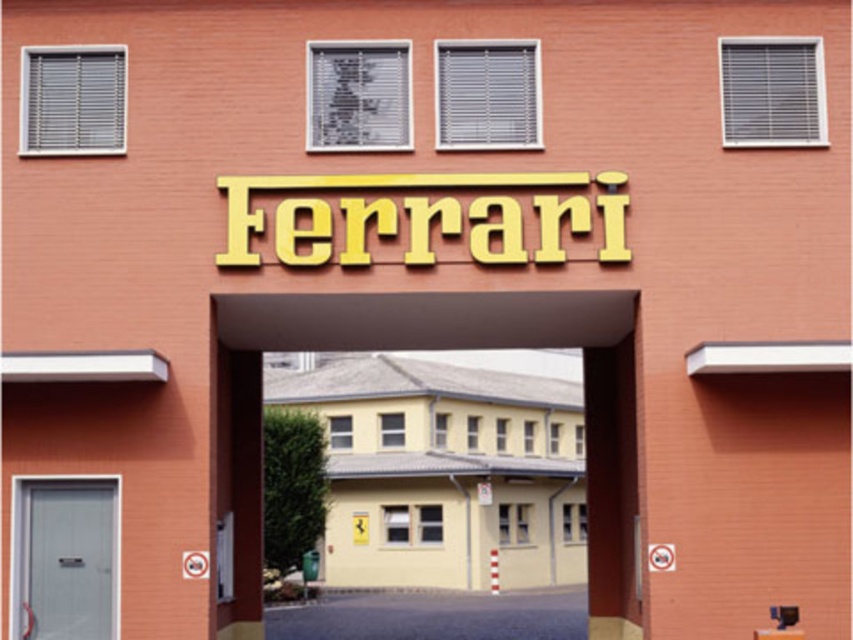
Describe the element at coordinates (492, 346) in the screenshot. I see `yellow matte building at center` at that location.

Is yellow matte building at center positioned in front of metallic gray door at lower left?

No, it is behind metallic gray door at lower left.

Who is more forward, (253, 314) or (45, 520)?

Point (45, 520)

Find the location of `yellow matte building at center`. yellow matte building at center is located at coordinates point(492,346).